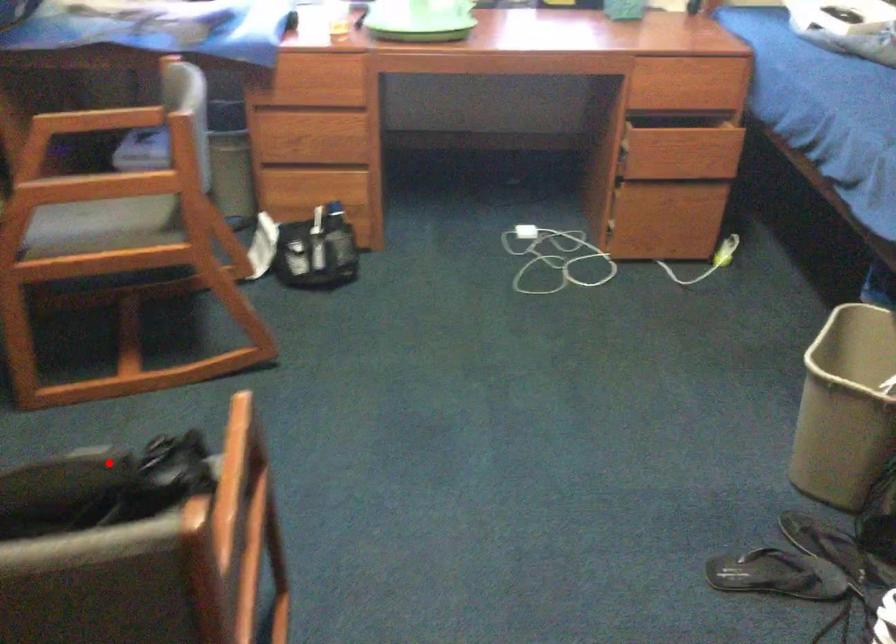
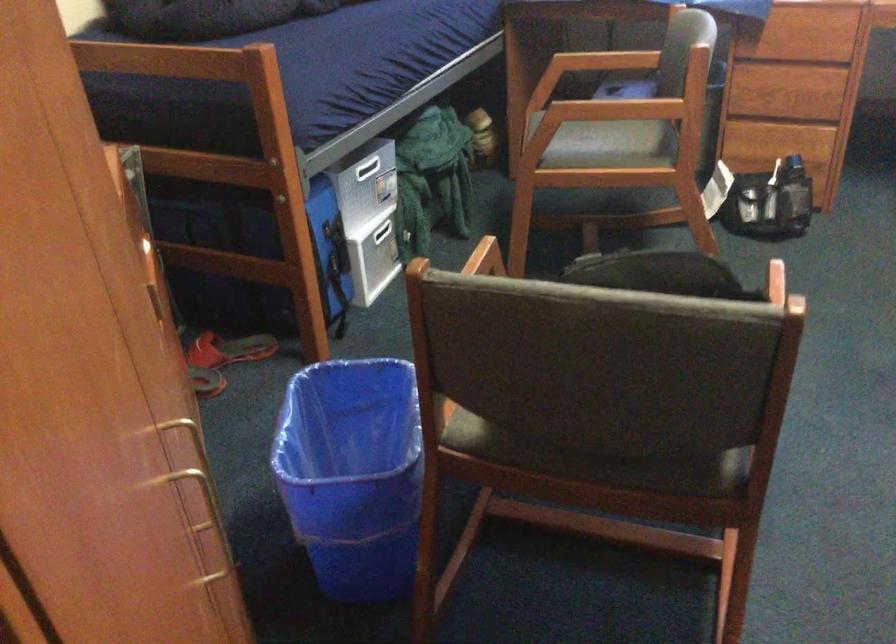
Question: I am providing you with two images of the same scene from different viewpoints. In image1, a red point is highlighted. Considering the same 3D point in image2, which of the following is correct?

Choices:
 (A) It is closer
 (B) It is farther

Answer: (B)